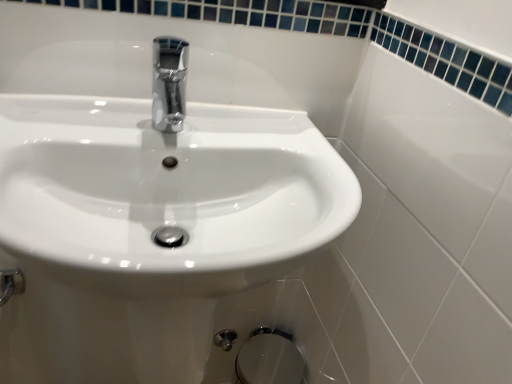
Question: Can you confirm if satin chrome bidet at lower center is bigger than chrome metallic faucet at center?

Choices:
 (A) no
 (B) yes

Answer: (B)

Question: Is satin chrome bidet at lower center at the right side of chrome metallic faucet at center?

Choices:
 (A) no
 (B) yes

Answer: (B)

Question: Does satin chrome bidet at lower center touch chrome metallic faucet at center?

Choices:
 (A) yes
 (B) no

Answer: (B)

Question: Does satin chrome bidet at lower center have a greater width compared to chrome metallic faucet at center?

Choices:
 (A) no
 (B) yes

Answer: (B)

Question: Does satin chrome bidet at lower center have a lesser width compared to chrome metallic faucet at center?

Choices:
 (A) yes
 (B) no

Answer: (B)

Question: Is satin chrome bidet at lower center positioned in front of chrome metallic faucet at center?

Choices:
 (A) yes
 (B) no

Answer: (B)

Question: Is chrome metallic faucet at center to the left of satin chrome bidet at lower center from the viewer's perspective?

Choices:
 (A) yes
 (B) no

Answer: (A)

Question: Does chrome metallic faucet at center have a greater height compared to satin chrome bidet at lower center?

Choices:
 (A) no
 (B) yes

Answer: (A)

Question: Considering the relative sizes of chrome metallic faucet at center and satin chrome bidet at lower center in the image provided, is chrome metallic faucet at center bigger than satin chrome bidet at lower center?

Choices:
 (A) yes
 (B) no

Answer: (B)

Question: From the image's perspective, is chrome metallic faucet at center beneath satin chrome bidet at lower center?

Choices:
 (A) no
 (B) yes

Answer: (A)

Question: Is chrome metallic faucet at center at the right side of satin chrome bidet at lower center?

Choices:
 (A) no
 (B) yes

Answer: (A)

Question: From the image's perspective, is chrome metallic faucet at center over satin chrome bidet at lower center?

Choices:
 (A) yes
 (B) no

Answer: (A)

Question: Can you confirm if white glossy sink at center is wider than chrome metallic faucet at center?

Choices:
 (A) no
 (B) yes

Answer: (B)